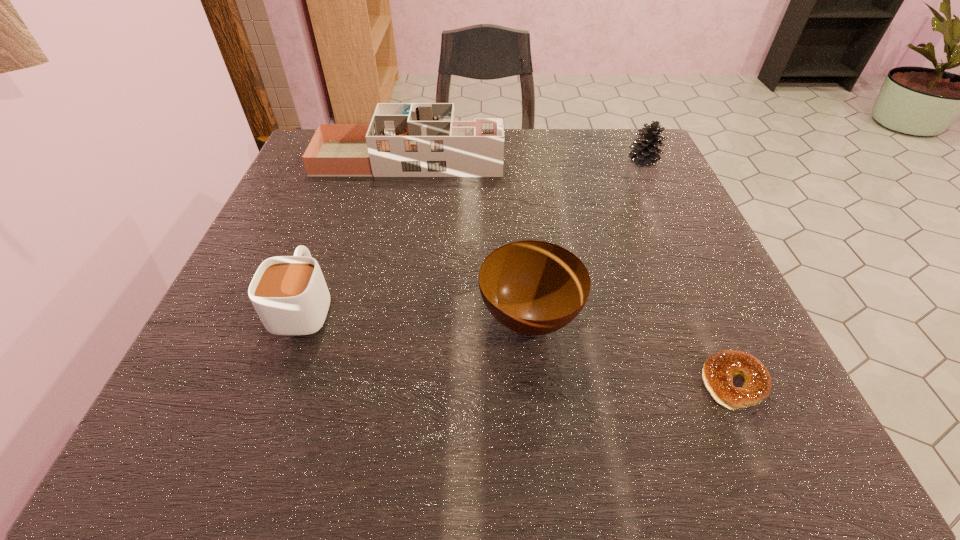
Locate an element on the screen. unoccupied area between the pinecone and the shortest object is located at coordinates click(688, 272).

This screenshot has height=540, width=960. In order to click on empty space that is in between the pinecone and the cup in this screenshot , I will do `click(474, 233)`.

I want to click on vacant area that lies between the pinecone and the bagel, so click(688, 272).

Where is `free area in between the dollhouse and the bowl`? The width and height of the screenshot is (960, 540). free area in between the dollhouse and the bowl is located at coordinates (469, 238).

The image size is (960, 540). Identify the location of free space between the pinecone and the dollhouse. (526, 160).

Identify which object is located as the third nearest to the bowl. Please provide its 2D coordinates. Your answer should be formatted as a tuple, i.e. [(x, y)], where the tuple contains the x and y coordinates of a point satisfying the conditions above.

[(403, 139)]

You are a GUI agent. You are given a task and a screenshot of the screen. Output one action in this format:
    pyautogui.click(x=<x>, y=<y>)
    Task: Click on the object that is the fourth closest to the bowl
    The height and width of the screenshot is (540, 960).
    Given the screenshot: What is the action you would take?
    pyautogui.click(x=645, y=152)

Where is `vacant space that satisfies the following two spatial constraints: 1. at the entrance of the dollhouse; 2. on the left side of the bagel`? The height and width of the screenshot is (540, 960). vacant space that satisfies the following two spatial constraints: 1. at the entrance of the dollhouse; 2. on the left side of the bagel is located at coordinates (362, 383).

Where is `free space that satisfies the following two spatial constraints: 1. at the entrance of the bagel; 2. on the right side of the dollhouse`? This screenshot has width=960, height=540. free space that satisfies the following two spatial constraints: 1. at the entrance of the bagel; 2. on the right side of the dollhouse is located at coordinates coord(362,383).

Locate an element on the screen. The image size is (960, 540). free space in the image that satisfies the following two spatial constraints: 1. at the entrance of the dollhouse; 2. on the left side of the pinecone is located at coordinates (408, 161).